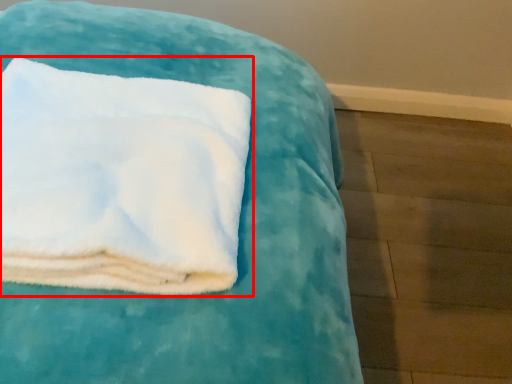
Question: From the image's perspective, what is the correct spatial relationship of towel (annotated by the red box) in relation to furniture?

Choices:
 (A) below
 (B) above

Answer: (B)